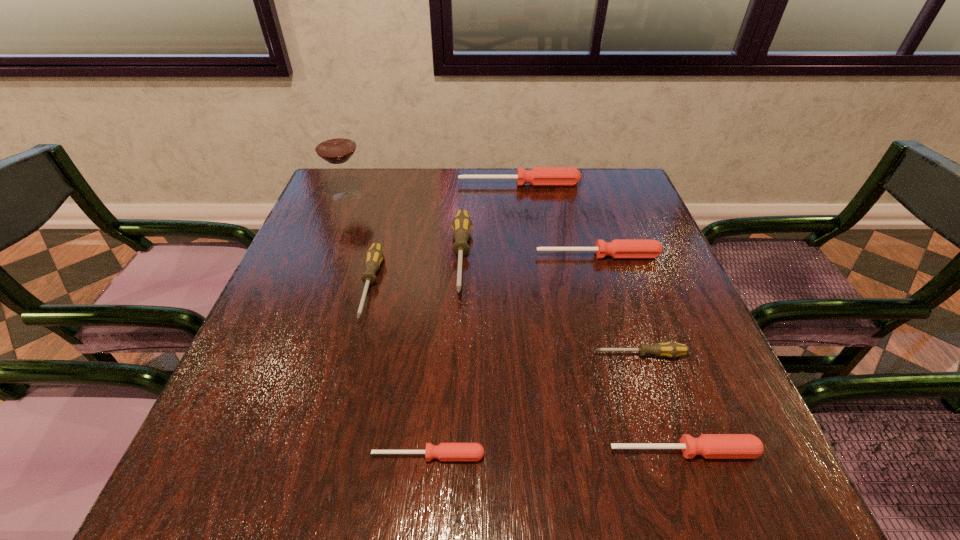
At what (x,y) coordinates should I click in order to perform the action: click on the closest gray screwdriver to the second farthest red screwdriver. Please return your answer as a coordinate pair (x, y). This screenshot has height=540, width=960. Looking at the image, I should click on (461, 224).

Identify the location of the closest red screwdriver relative to the second gray screwdriver from right to left. This screenshot has width=960, height=540. 618,248.

This screenshot has height=540, width=960. What are the coordinates of `the second closest red screwdriver relative to the farthest screwdriver` in the screenshot? It's located at click(711, 446).

Identify the location of free space that satisfies the following two spatial constraints: 1. on the front side of the third biggest red screwdriver; 2. on the right side of the second farthest red screwdriver. The image size is (960, 540). (657, 451).

Where is `blank space that satisfies the following two spatial constraints: 1. at the tip of the second smallest red screwdriver; 2. on the left side of the smallest gray screwdriver`? This screenshot has height=540, width=960. blank space that satisfies the following two spatial constraints: 1. at the tip of the second smallest red screwdriver; 2. on the left side of the smallest gray screwdriver is located at coordinates (671, 451).

This screenshot has height=540, width=960. Find the location of `vacant space that satisfies the following two spatial constraints: 1. on the front side of the leftmost object; 2. on the left side of the third nearest red screwdriver`. vacant space that satisfies the following two spatial constraints: 1. on the front side of the leftmost object; 2. on the left side of the third nearest red screwdriver is located at coordinates (324, 255).

The height and width of the screenshot is (540, 960). I want to click on vacant point that satisfies the following two spatial constraints: 1. at the tip of the leftmost gray screwdriver; 2. on the right side of the third biggest red screwdriver, so click(327, 451).

Locate an element on the screen. This screenshot has height=540, width=960. vacant space that satisfies the following two spatial constraints: 1. at the tip of the biggest gray screwdriver; 2. on the right side of the third biggest red screwdriver is located at coordinates (452, 451).